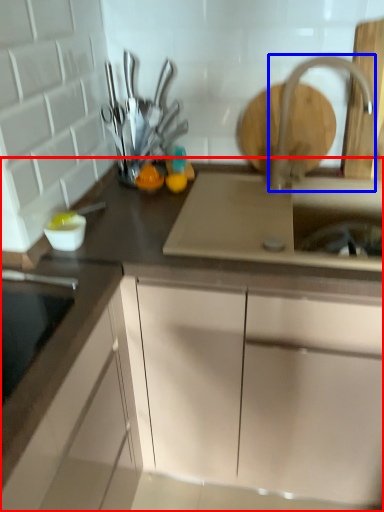
Question: Which object is closer to the camera taking this photo, cabinetry (highlighted by a red box) or tap (highlighted by a blue box)?

Choices:
 (A) cabinetry
 (B) tap

Answer: (A)